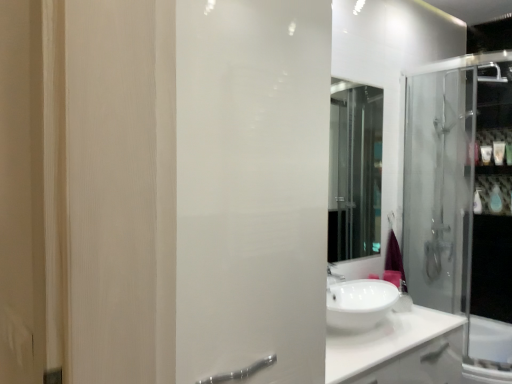
What is the approximate width of white glossy bottle at right, which ranks as the first toiletry in bottom-to-top order?

2.41 inches.

Describe the element at coordinates (477, 203) in the screenshot. The image size is (512, 384). I see `white glossy bottle at right, which ranks as the first toiletry in bottom-to-top order` at that location.

This screenshot has width=512, height=384. Describe the element at coordinates (495, 199) in the screenshot. I see `blue glossy soap at upper right, marked as the 4th toiletry in a top-to-bottom arrangement` at that location.

Image resolution: width=512 pixels, height=384 pixels. What do you see at coordinates (252, 187) in the screenshot?
I see `white frosted glass screen door at center` at bounding box center [252, 187].

Identify the location of white glossy counter top at center. This screenshot has height=384, width=512. (398, 350).

What do you see at coordinates (398, 350) in the screenshot? I see `white glossy counter top at center` at bounding box center [398, 350].

In the scene shown: What is the approximate width of transparent glass shower door at right?

The width of transparent glass shower door at right is 36.14 inches.

Describe the element at coordinates (473, 153) in the screenshot. The width and height of the screenshot is (512, 384). I see `white glossy bottle at upper right, the first toiletry when ordered from top to bottom` at that location.

This screenshot has height=384, width=512. What do you see at coordinates (499, 152) in the screenshot?
I see `white glossy toothpaste tube at upper right, acting as the second toiletry starting from the top` at bounding box center [499, 152].

Find the location of a particular element. Image resolution: width=512 pixels, height=384 pixels. white glossy bottle at right, marked as the fifth toiletry in a top-to-bottom arrangement is located at coordinates (477, 203).

Between transparent glass shower door at right and white glossy counter top at center, which one has larger width?

transparent glass shower door at right.

Considering their positions, is transparent glass shower door at right located in front of or behind white glossy counter top at center?

In the image, transparent glass shower door at right appears behind white glossy counter top at center.

Consider the image. Can you confirm if transparent glass shower door at right is smaller than white glossy counter top at center?

Incorrect, transparent glass shower door at right is not smaller in size than white glossy counter top at center.

The image size is (512, 384). Find the location of `shower door located above the white glossy counter top at center (from a real-world perspective)`. shower door located above the white glossy counter top at center (from a real-world perspective) is located at coordinates (461, 203).

From their relative heights in the image, would you say white glossy soap at upper right, which ranks as the third toiletry in top-to-bottom order, is taller or shorter than blue glossy soap at upper right, marked as the 4th toiletry in a top-to-bottom arrangement?

Considering their sizes, white glossy soap at upper right, which ranks as the third toiletry in top-to-bottom order, has less height than blue glossy soap at upper right, marked as the 4th toiletry in a top-to-bottom arrangement.

Considering the sizes of objects white glossy soap at upper right, acting as the 3th toiletry starting from the bottom, and blue glossy soap at upper right, which appears as the 2th toiletry when ordered from the bottom, in the image provided, who is thinner, white glossy soap at upper right, acting as the 3th toiletry starting from the bottom, or blue glossy soap at upper right, which appears as the 2th toiletry when ordered from the bottom,?

white glossy soap at upper right, acting as the 3th toiletry starting from the bottom.

Does white glossy soap at upper right, acting as the 3th toiletry starting from the bottom, contain blue glossy soap at upper right, which appears as the 2th toiletry when ordered from the bottom?

Actually, blue glossy soap at upper right, which appears as the 2th toiletry when ordered from the bottom, is outside white glossy soap at upper right, acting as the 3th toiletry starting from the bottom.

Is white glossy soap at upper right, which ranks as the third toiletry in top-to-bottom order, turned away from blue glossy soap at upper right, marked as the 4th toiletry in a top-to-bottom arrangement?

No, white glossy soap at upper right, which ranks as the third toiletry in top-to-bottom order,'s orientation is not away from blue glossy soap at upper right, marked as the 4th toiletry in a top-to-bottom arrangement.

Find the location of a particular element. The image size is (512, 384). counter top in front of the white glossy toothpaste tube at upper right, which ranks as the fourth toiletry in bottom-to-top order is located at coordinates (398, 350).

Is white glossy counter top at center bigger than white glossy toothpaste tube at upper right, acting as the second toiletry starting from the top?

Indeed, white glossy counter top at center has a larger size compared to white glossy toothpaste tube at upper right, acting as the second toiletry starting from the top.

How many degrees apart are the facing directions of white glossy counter top at center and white glossy toothpaste tube at upper right, which ranks as the fourth toiletry in bottom-to-top order?

They differ by 90.8 degrees in their facing directions.

Based on their positions, is white glossy counter top at center located to the left or right of white glossy toothpaste tube at upper right, acting as the second toiletry starting from the top?

In the image, white glossy counter top at center appears on the left side of white glossy toothpaste tube at upper right, acting as the second toiletry starting from the top.

Which object is more forward, white glossy counter top at center or white frosted glass screen door at center?

white frosted glass screen door at center is more forward.

From a real-world perspective, is white glossy counter top at center beneath white frosted glass screen door at center?

Correct, in the physical world, white glossy counter top at center is lower than white frosted glass screen door at center.

From the image's perspective, is white glossy counter top at center located beneath white frosted glass screen door at center?

Correct, white glossy counter top at center appears lower than white frosted glass screen door at center in the image.

Can you confirm if white glossy counter top at center is thinner than white frosted glass screen door at center?

Indeed, white glossy counter top at center has a lesser width compared to white frosted glass screen door at center.

Which object is more forward, white frosted glass screen door at center or white glossy bottle at upper right, the 5th toiletry when ordered from bottom to top?

white frosted glass screen door at center is in front.

Is white frosted glass screen door at center not inside white glossy bottle at upper right, the first toiletry when ordered from top to bottom?

Absolutely, white frosted glass screen door at center is external to white glossy bottle at upper right, the first toiletry when ordered from top to bottom.

Consider the image. Which is farther, (294, 59) or (473, 160)?

Positioned behind is point (473, 160).

From a real-world perspective, starting from the white glossy toothpaste tube at upper right, which ranks as the fourth toiletry in bottom-to-top order, which toiletry is the 1st one below it? Please provide its 2D coordinates.

[(486, 154)]

Which object is closer to the camera taking this photo, white glossy toothpaste tube at upper right, acting as the second toiletry starting from the top, or white glossy soap at upper right, which ranks as the third toiletry in top-to-bottom order?

white glossy toothpaste tube at upper right, acting as the second toiletry starting from the top, is more forward.

How many degrees apart are the facing directions of white glossy toothpaste tube at upper right, which ranks as the fourth toiletry in bottom-to-top order, and white glossy soap at upper right, acting as the 3th toiletry starting from the bottom?

0.00353 degrees separate the facing orientations of white glossy toothpaste tube at upper right, which ranks as the fourth toiletry in bottom-to-top order, and white glossy soap at upper right, acting as the 3th toiletry starting from the bottom.

Which is correct: white glossy toothpaste tube at upper right, acting as the second toiletry starting from the top, is inside white glossy soap at upper right, acting as the 3th toiletry starting from the bottom, or outside of it?

white glossy toothpaste tube at upper right, acting as the second toiletry starting from the top, is outside white glossy soap at upper right, acting as the 3th toiletry starting from the bottom.

Does blue glossy soap at upper right, which appears as the 2th toiletry when ordered from the bottom, touch transparent glass shower door at right?

No, blue glossy soap at upper right, which appears as the 2th toiletry when ordered from the bottom, is not with transparent glass shower door at right.

From a real-world perspective, between blue glossy soap at upper right, marked as the 4th toiletry in a top-to-bottom arrangement, and transparent glass shower door at right, who is vertically higher?

blue glossy soap at upper right, marked as the 4th toiletry in a top-to-bottom arrangement.

Which is in front, blue glossy soap at upper right, marked as the 4th toiletry in a top-to-bottom arrangement, or transparent glass shower door at right?

transparent glass shower door at right.

Which object is wider, blue glossy soap at upper right, which appears as the 2th toiletry when ordered from the bottom, or transparent glass shower door at right?

transparent glass shower door at right.

Find the location of a particular element. This screenshot has height=384, width=512. shower door lying above the white glossy counter top at center (from the image's perspective) is located at coordinates (461, 203).

From the white glossy soap at upper right, which ranks as the third toiletry in top-to-bottom order, count 1st toiletrys forward and point to it. Please provide its 2D coordinates.

[(495, 199)]

Looking at the image, which one is located closer to transparent glass shower door at right, white glossy toothpaste tube at upper right, which ranks as the fourth toiletry in bottom-to-top order, or white glossy counter top at center?

white glossy toothpaste tube at upper right, which ranks as the fourth toiletry in bottom-to-top order, is closer to transparent glass shower door at right.

Looking at the image, which one is located closer to blue glossy soap at upper right, which appears as the 2th toiletry when ordered from the bottom, white glossy bottle at upper right, the 5th toiletry when ordered from bottom to top, or white glossy bottle at right, which ranks as the first toiletry in bottom-to-top order?

white glossy bottle at right, which ranks as the first toiletry in bottom-to-top order, is closer to blue glossy soap at upper right, which appears as the 2th toiletry when ordered from the bottom.

From the image, which object appears to be farther from white glossy bottle at upper right, the 5th toiletry when ordered from bottom to top, white glossy counter top at center or white glossy toothpaste tube at upper right, acting as the second toiletry starting from the top?

Based on the image, white glossy counter top at center appears to be further to white glossy bottle at upper right, the 5th toiletry when ordered from bottom to top.

When comparing their distances from white glossy toothpaste tube at upper right, acting as the second toiletry starting from the top, does blue glossy soap at upper right, which appears as the 2th toiletry when ordered from the bottom, or white frosted glass screen door at center seem closer?

Among the two, blue glossy soap at upper right, which appears as the 2th toiletry when ordered from the bottom, is located nearer to white glossy toothpaste tube at upper right, acting as the second toiletry starting from the top.

Looking at the image, which one is located further to transparent glass shower door at right, blue glossy soap at upper right, marked as the 4th toiletry in a top-to-bottom arrangement, or white glossy bottle at upper right, the 5th toiletry when ordered from bottom to top?

blue glossy soap at upper right, marked as the 4th toiletry in a top-to-bottom arrangement, is positioned further to the anchor transparent glass shower door at right.

Estimate the real-world distances between objects in this image. Which object is closer to white glossy bottle at upper right, the first toiletry when ordered from top to bottom, white frosted glass screen door at center or white glossy toothpaste tube at upper right, which ranks as the fourth toiletry in bottom-to-top order?

The object closer to white glossy bottle at upper right, the first toiletry when ordered from top to bottom, is white glossy toothpaste tube at upper right, which ranks as the fourth toiletry in bottom-to-top order.

In the scene shown: Based on their spatial positions, is white glossy bottle at upper right, the 5th toiletry when ordered from bottom to top, or white frosted glass screen door at center further from white glossy counter top at center?

white glossy bottle at upper right, the 5th toiletry when ordered from bottom to top, is positioned further to the anchor white glossy counter top at center.

From the image, which object appears to be farther from white glossy soap at upper right, which ranks as the third toiletry in top-to-bottom order, white glossy bottle at right, marked as the fifth toiletry in a top-to-bottom arrangement, or white glossy counter top at center?

white glossy counter top at center.

Locate an element on the screen. shower door between white glossy counter top at center and blue glossy soap at upper right, which appears as the 2th toiletry when ordered from the bottom, from front to back is located at coordinates (461, 203).

In order to click on counter top between white frosted glass screen door at center and blue glossy soap at upper right, which appears as the 2th toiletry when ordered from the bottom, from front to back in this screenshot , I will do `click(398, 350)`.

You are a GUI agent. You are given a task and a screenshot of the screen. Output one action in this format:
    pyautogui.click(x=<x>, y=<y>)
    Task: Click on the counter top located between white frosted glass screen door at center and white glossy bottle at right, which ranks as the first toiletry in bottom-to-top order, in the depth direction
    
    Given the screenshot: What is the action you would take?
    pyautogui.click(x=398, y=350)

Find the location of `shower door located between white frosted glass screen door at center and blue glossy soap at upper right, marked as the 4th toiletry in a top-to-bottom arrangement, in the depth direction`. shower door located between white frosted glass screen door at center and blue glossy soap at upper right, marked as the 4th toiletry in a top-to-bottom arrangement, in the depth direction is located at coordinates (461, 203).